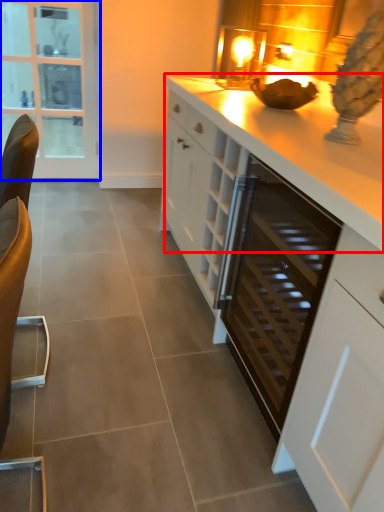
Question: Which of the following is the closest to the observer, countertop (highlighted by a red box) or glass door (highlighted by a blue box)?

Choices:
 (A) countertop
 (B) glass door

Answer: (A)